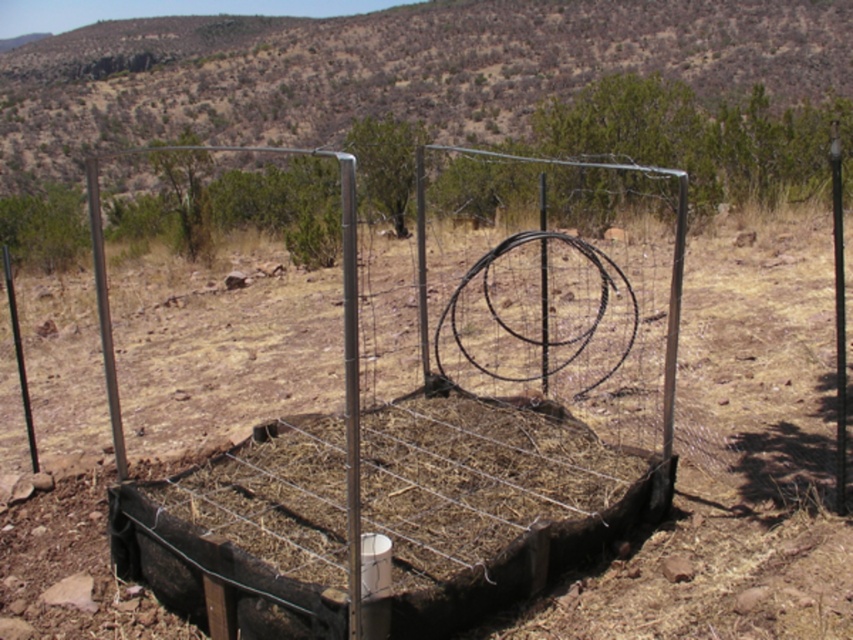
Question: Is metal wire fence at center in front of metallic pole at right?

Choices:
 (A) no
 (B) yes

Answer: (B)

Question: Considering the real-world distances, which object is farthest from the metallic pole at left?

Choices:
 (A) metallic pole at right
 (B) metal wire fence at center

Answer: (A)

Question: Which point appears closest to the camera in this image?

Choices:
 (A) (305, 512)
 (B) (837, 426)

Answer: (B)

Question: Is the position of metal wire fence at center less distant than that of metallic pole at right?

Choices:
 (A) yes
 (B) no

Answer: (A)

Question: Considering the real-world distances, which object is closest to the metal wire fence at center?

Choices:
 (A) metallic pole at left
 (B) metallic pole at right

Answer: (B)

Question: Can you confirm if metallic pole at right is positioned to the left of metallic pole at left?

Choices:
 (A) yes
 (B) no

Answer: (B)